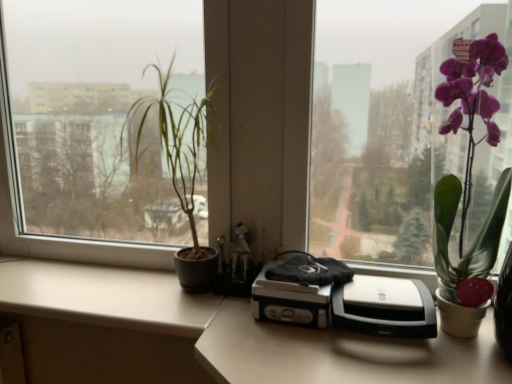
Find the location of a particular element. This screenshot has width=512, height=384. blank space above beige matte counter top at lower left (from a real-world perspective) is located at coordinates (56, 283).